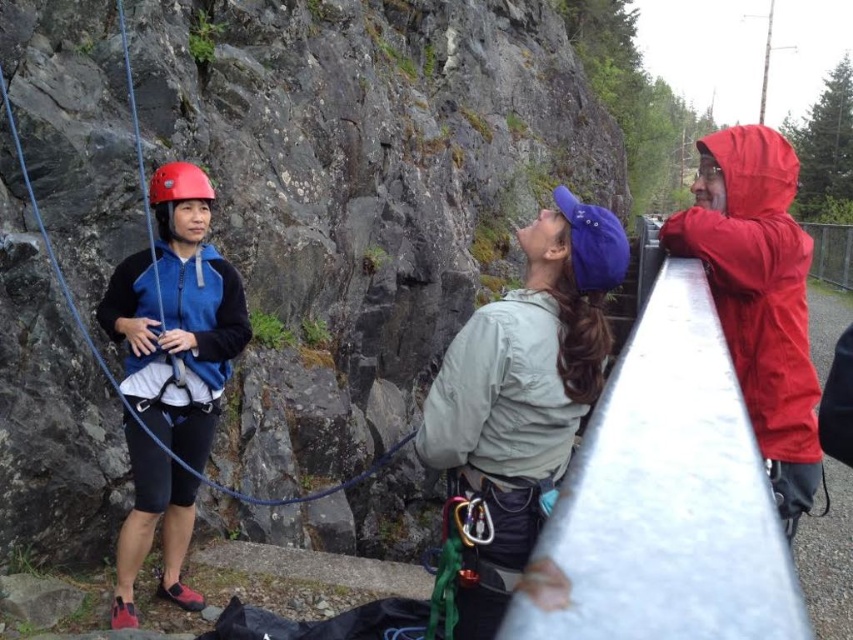
Question: Based on their relative distances, which object is farther from the matte blue jacket at left?

Choices:
 (A) light gray fabric jacket at center
 (B) red waterproof jacket at upper right

Answer: (B)

Question: Which object appears closest to the camera in this image?

Choices:
 (A) red waterproof jacket at upper right
 (B) matte blue jacket at left
 (C) light gray fabric jacket at center

Answer: (A)

Question: In this image, where is light gray fabric jacket at center located relative to matte blue jacket at left?

Choices:
 (A) above
 (B) below

Answer: (A)

Question: Is matte blue jacket at left below red waterproof jacket at upper right?

Choices:
 (A) no
 (B) yes

Answer: (B)

Question: Which point is farther to the camera?

Choices:
 (A) (114, 612)
 (B) (486, 429)
 (C) (51, 257)
 (D) (735, 349)

Answer: (C)

Question: Can you confirm if light gray fabric jacket at center is thinner than matte blue jacket at left?

Choices:
 (A) no
 (B) yes

Answer: (B)